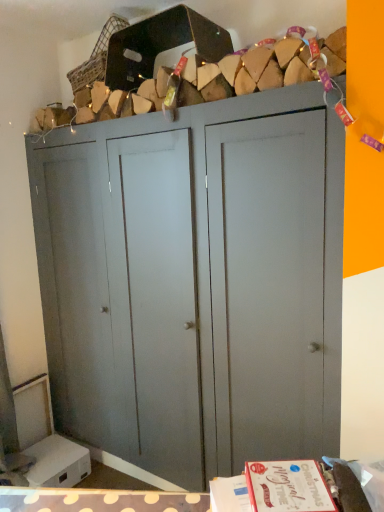
Question: From the image's perspective, would you say matte gray cupboard at center is positioned over woven fabric basket at upper center?

Choices:
 (A) no
 (B) yes

Answer: (A)

Question: Is matte gray cupboard at center wider than woven fabric basket at upper center?

Choices:
 (A) yes
 (B) no

Answer: (A)

Question: Is matte gray cupboard at center closer to camera compared to woven fabric basket at upper center?

Choices:
 (A) yes
 (B) no

Answer: (A)

Question: Can you confirm if matte gray cupboard at center is smaller than woven fabric basket at upper center?

Choices:
 (A) yes
 (B) no

Answer: (B)

Question: Is matte gray cupboard at center far away from woven fabric basket at upper center?

Choices:
 (A) yes
 (B) no

Answer: (A)

Question: Is matte gray cupboard at center to the right of woven fabric basket at upper center from the viewer's perspective?

Choices:
 (A) yes
 (B) no

Answer: (A)

Question: From a real-world perspective, is woven fabric basket at upper center on matte gray cupboard at center?

Choices:
 (A) no
 (B) yes

Answer: (B)

Question: Is woven fabric basket at upper center looking in the opposite direction of matte gray cupboard at center?

Choices:
 (A) no
 (B) yes

Answer: (A)

Question: Can you confirm if woven fabric basket at upper center is bigger than matte gray cupboard at center?

Choices:
 (A) yes
 (B) no

Answer: (B)

Question: Does woven fabric basket at upper center have a greater width compared to matte gray cupboard at center?

Choices:
 (A) yes
 (B) no

Answer: (B)

Question: Is woven fabric basket at upper center at the left side of matte gray cupboard at center?

Choices:
 (A) no
 (B) yes

Answer: (B)

Question: From the image's perspective, is woven fabric basket at upper center beneath matte gray cupboard at center?

Choices:
 (A) yes
 (B) no

Answer: (B)

Question: Considering the positions of point (339, 274) and point (74, 80), is point (339, 274) closer or farther from the camera than point (74, 80)?

Choices:
 (A) closer
 (B) farther

Answer: (A)